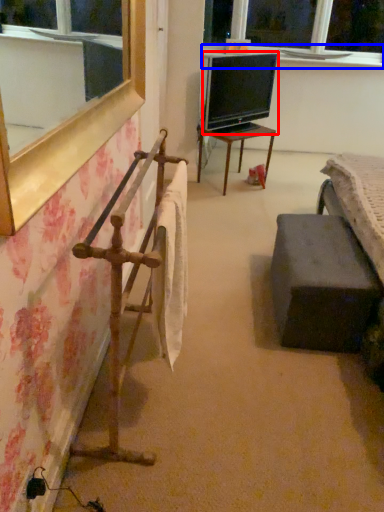
Question: Which object is closer to the camera taking this photo, television (highlighted by a red box) or window sill (highlighted by a blue box)?

Choices:
 (A) television
 (B) window sill

Answer: (A)